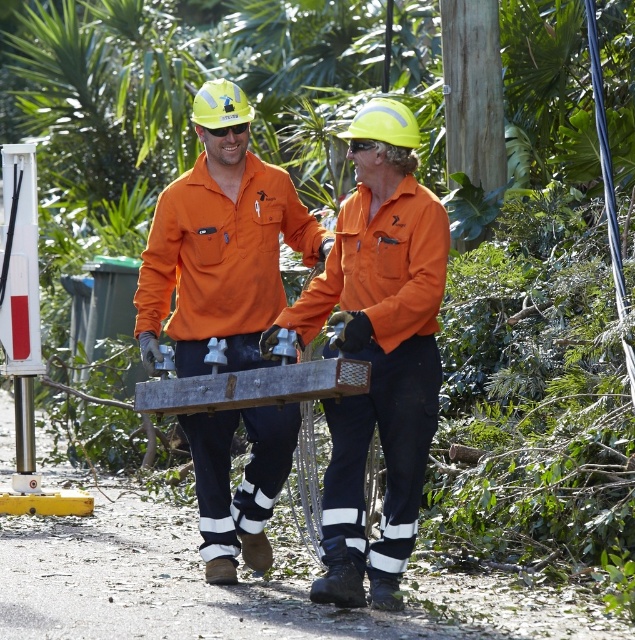
Who is more forward, (384, 195) or (255, 198)?

Point (384, 195)

The image size is (635, 640). What do you see at coordinates (377, 352) in the screenshot?
I see `orange matte workwear at center` at bounding box center [377, 352].

The width and height of the screenshot is (635, 640). I want to click on orange matte workwear at center, so click(x=377, y=352).